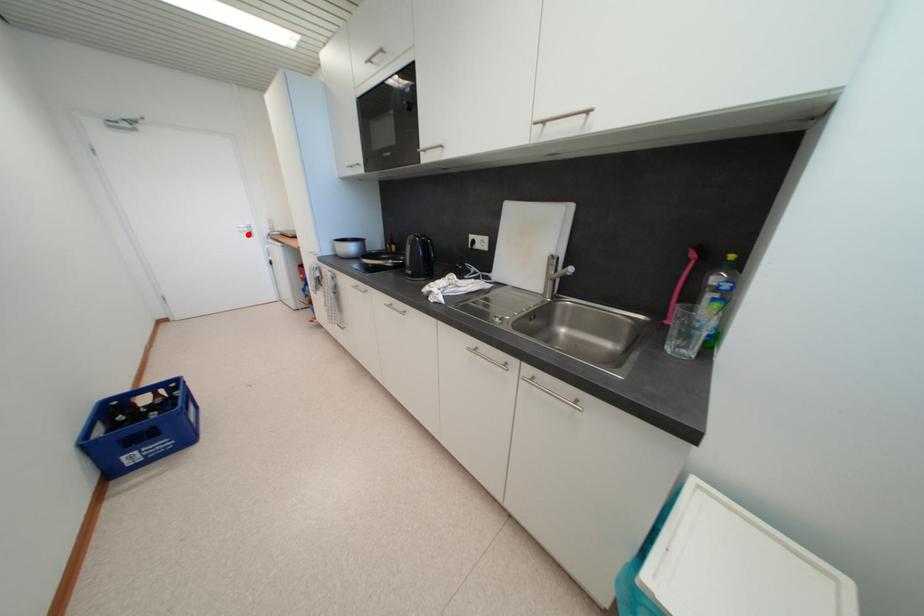
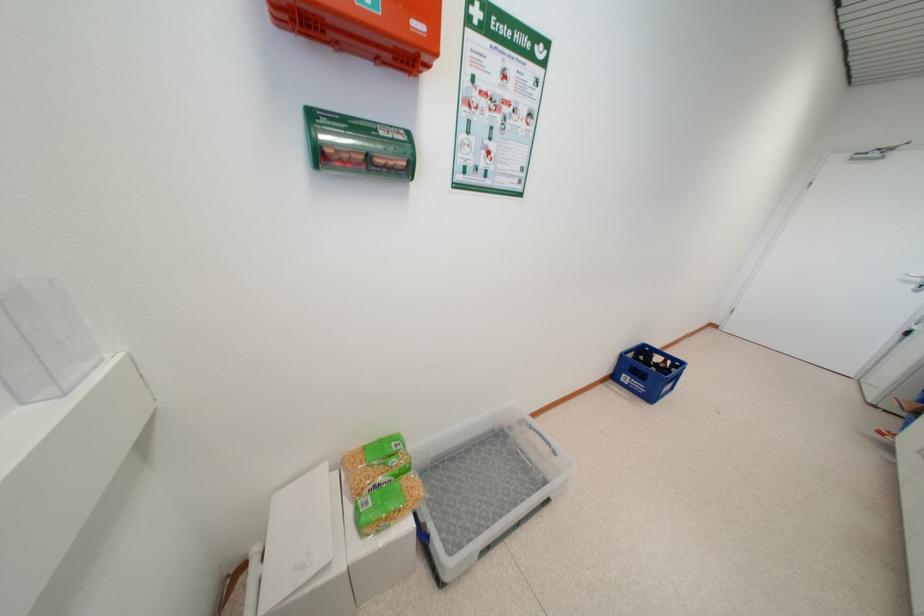
Question: I am providing you with two images of the same scene from different viewpoints. Given a red point in image1, look at the same physical point in image2. Is it:

Choices:
 (A) Closer to the viewpoint
 (B) Farther from the viewpoint

Answer: (B)